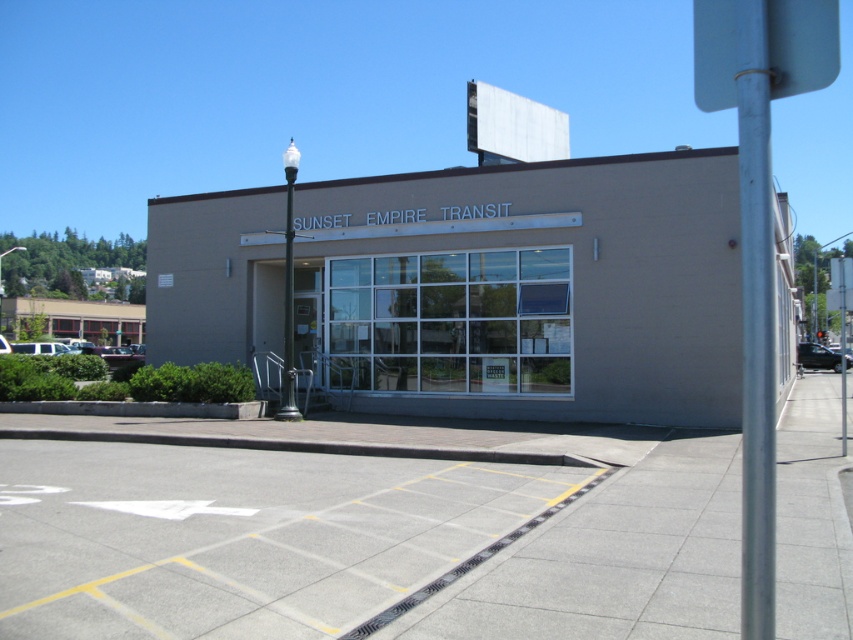
You are a city planner assessing the visibility of the silver metallic pole at right from the street. Considering the beige concrete building at center, which object would block the view of the pole if someone is standing across the street?

The beige concrete building at center would block the view of the silver metallic pole at right because it is taller than the pole.

You are a delivery driver who needs to park your vehicle in the parking area in front of the beige concrete building at center. The parking area has a maximum vehicle length of 6 meters. Your truck is 5.8 meters long. Can you safely park your truck in the parking area without overhanging the parking lines?

The beige concrete building at center is located at point coordinates (531, 289). However, the provided information does not specify the dimensions of the parking spaces or the distance between the parking lines. Therefore, it is impossible to determine if the truck will overhang. Please check the parking space length before parking.

From the picture: You are standing at the point labeled point [531,289] in the image of the SUNSET EMPIRE TRANSIT building. What is the nearest object to you?

The point [531,289] indicates beige concrete building at center, so the nearest object to you is the beige concrete building at center.